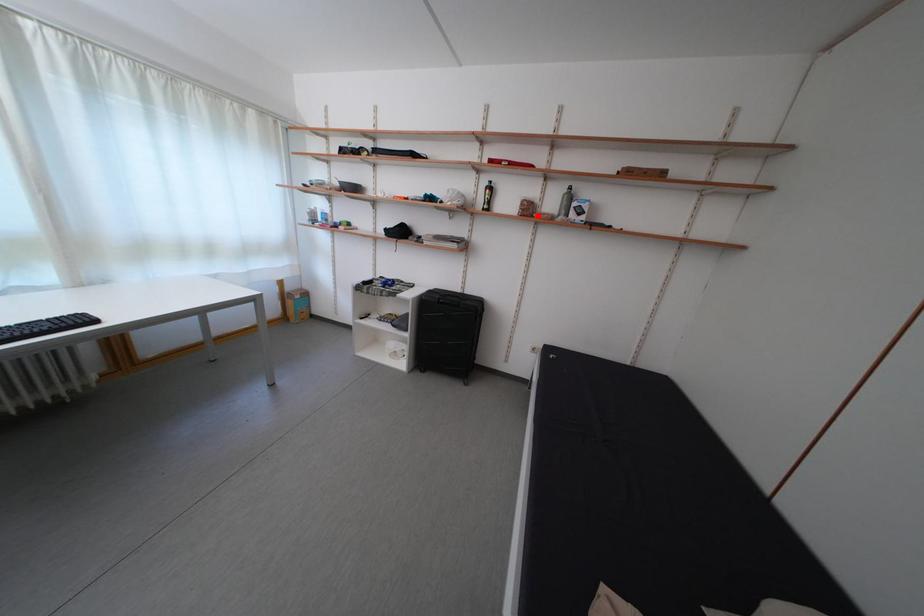
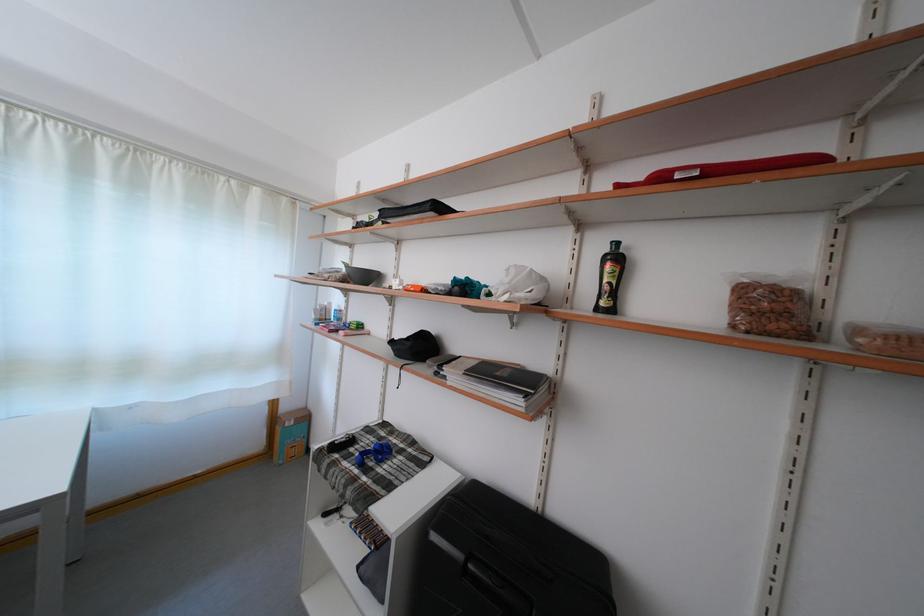
Question: I am providing you with two images of the same scene from different viewpoints. Given a red point in image1, look at the same physical point in image2. Is it:

Choices:
 (A) Closer to the viewpoint
 (B) Farther from the viewpoint

Answer: (B)